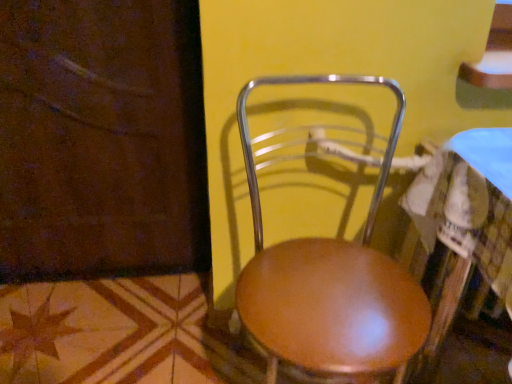
Question: From a real-world perspective, relative to brown wood screen door at lower left, is wooden seat at center vertically above or below?

Choices:
 (A) below
 (B) above

Answer: (A)

Question: Is wooden seat at center to the left or to the right of brown wood screen door at lower left in the image?

Choices:
 (A) left
 (B) right

Answer: (B)

Question: Based on their relative distances, which object is farther from the shiny brown table at center?

Choices:
 (A) brown wood screen door at lower left
 (B) wooden seat at center

Answer: (A)

Question: Based on their relative distances, which object is farther from the wooden seat at center?

Choices:
 (A) brown wood screen door at lower left
 (B) shiny brown table at center

Answer: (A)